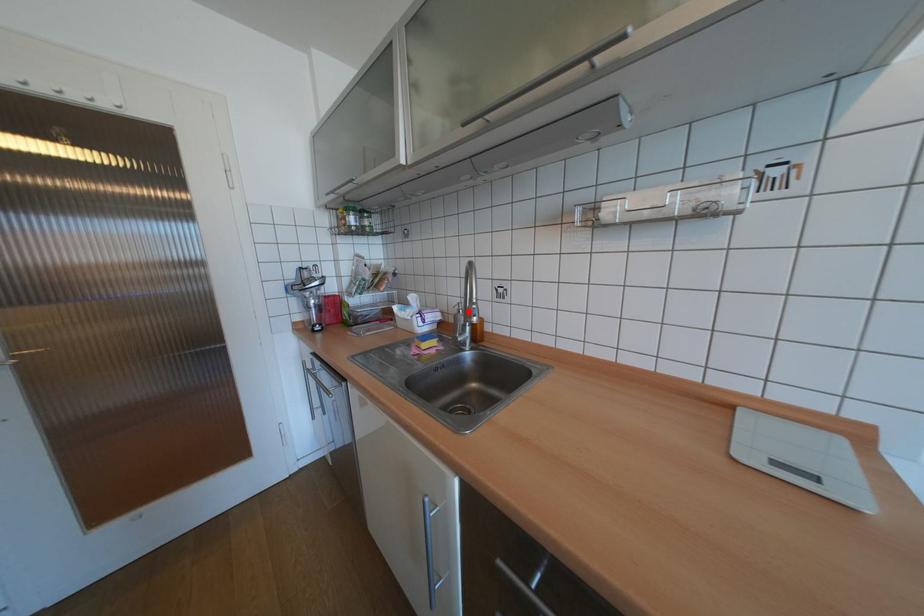
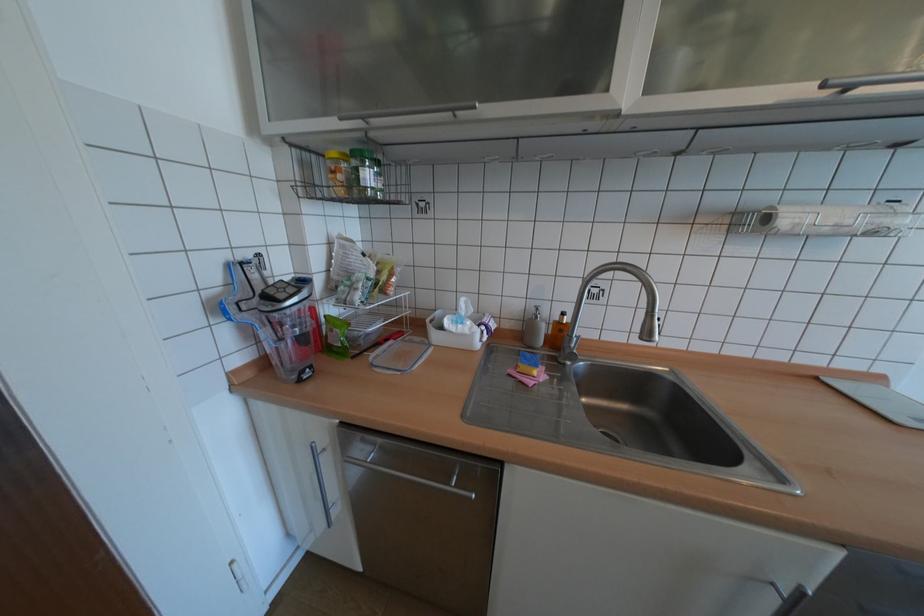
The point at the highlighted location is marked in the first image. Where is the corresponding point in the second image?

(545, 317)